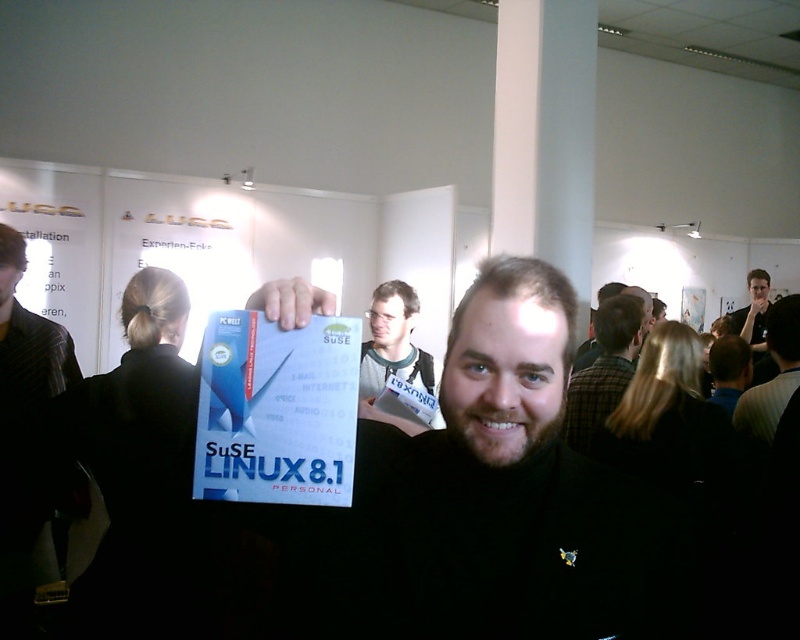
You are at the booth and need to hand out a document to someone. The document is placed on the white paper at center. If you want to reach it, will you have to bend down from your standing position compared to reaching the dark gray shirt at center?

The white paper at center is shorter than the dark gray shirt at center, so you would need to bend down to reach the white paper at center but not the dark gray shirt at center.

You are at a conference booth and notice two people in dark gray shirt at center and black shirt at center. Which one is standing lower in the image?

The dark gray shirt at center is located below the black shirt at center, so the person wearing the dark gray shirt at center is standing lower in the image.

You are a photographer at the event and want to capture a clear photo of both the white paper at center and the dark gray shirt at center. Based on their positions, which one should you focus on first to ensure both are in focus?

You should focus on the dark gray shirt at center first because the white paper at center is above it, so adjusting focus starting from the lower object ensures both are in focus.